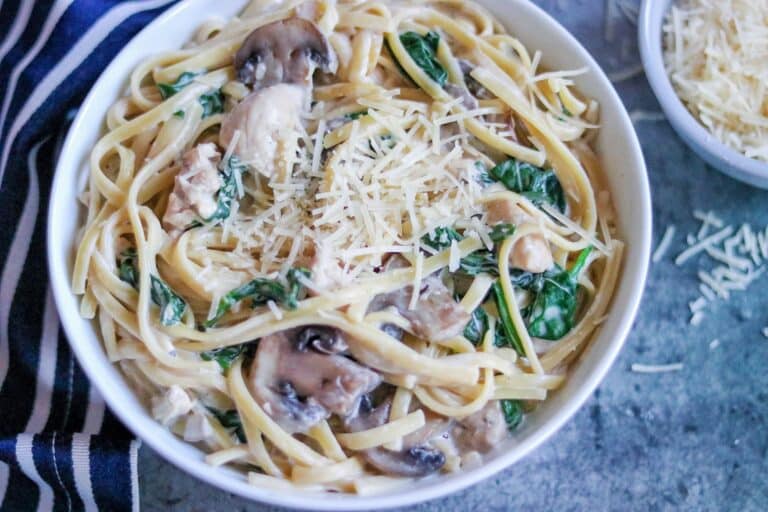
At what (x,y) coordinates should I click in order to perform the action: click on bowl containing cheese. Please return your answer as a coordinate pair (x, y). This screenshot has height=512, width=768. Looking at the image, I should click on (353, 193), (730, 102).